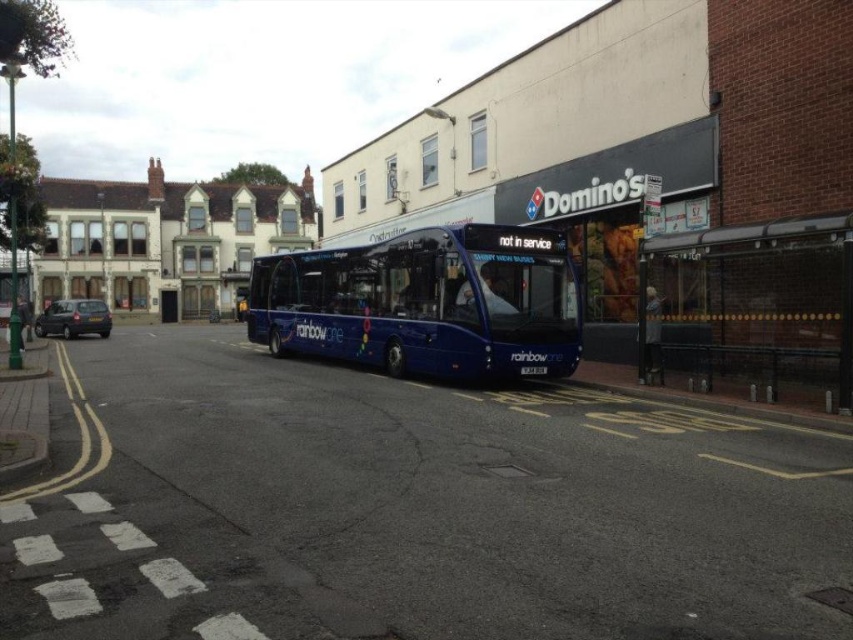
You are a pedestrian waiting at the bus stop. You want to board the blue metallic bus at center when it becomes available. Is the transparent plastic bus stop at right located in front of or behind the bus?

The transparent plastic bus stop at right is behind the blue metallic bus at center, so it is located behind the bus.

You are standing on the street and want to take a photo of both the blue bus parked at the bus stop and the Domino pizza outlet. Which point is closer to you, point (343, 288) or point (656, 323)?

Point (343, 288) is closer to you than point (656, 323).